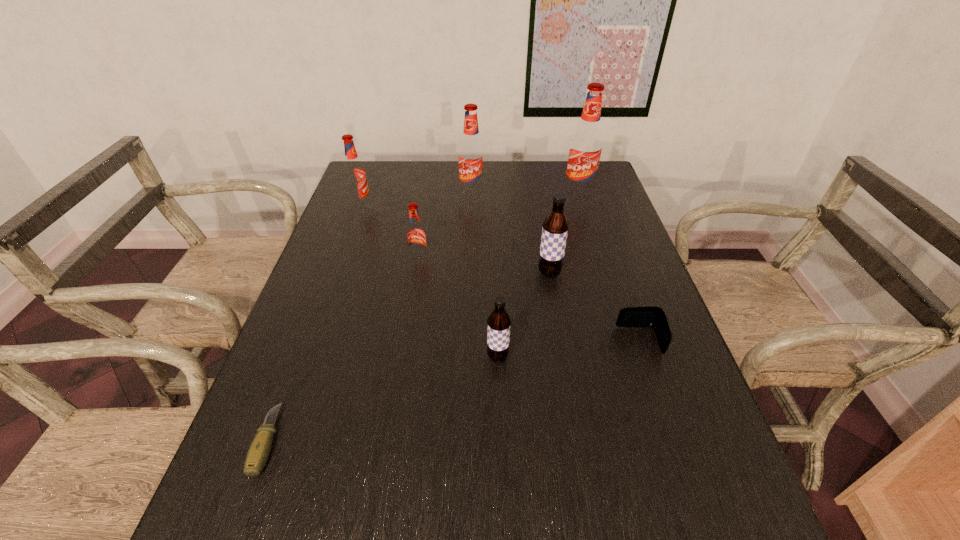
This screenshot has width=960, height=540. What are the coordinates of `free point that satisfies the following two spatial constraints: 1. on the back side of the second smallest red root beer; 2. on the left side of the fifth object from right to left` in the screenshot? It's located at (366, 193).